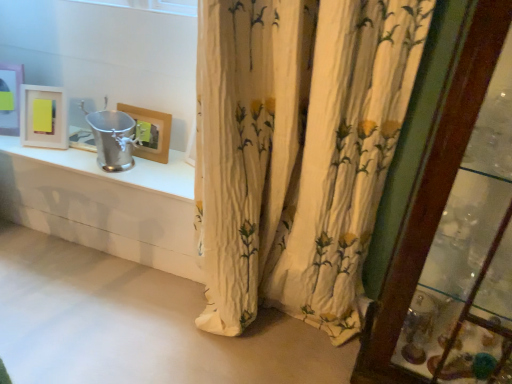
Question: Is the position of matte white picture frame at upper left, which ranks as the 1th picture frame in left-to-right order, less distant than that of matte white picture frame at upper left, which is counted as the 2th picture frame, starting from the right?

Choices:
 (A) no
 (B) yes

Answer: (A)

Question: From a real-world perspective, is matte white picture frame at upper left, which ranks as the 1th picture frame in left-to-right order, located higher than matte white picture frame at upper left, the second picture frame positioned from the left?

Choices:
 (A) yes
 (B) no

Answer: (A)

Question: Is matte white picture frame at upper left, which is counted as the third picture frame, starting from the right, wider than matte white picture frame at upper left, which is counted as the 2th picture frame, starting from the right?

Choices:
 (A) yes
 (B) no

Answer: (B)

Question: From the image's perspective, would you say matte white picture frame at upper left, which ranks as the 1th picture frame in left-to-right order, is shown under matte white picture frame at upper left, which is counted as the 2th picture frame, starting from the right?

Choices:
 (A) no
 (B) yes

Answer: (A)

Question: From a real-world perspective, is matte white picture frame at upper left, which is counted as the third picture frame, starting from the right, beneath matte white picture frame at upper left, which is counted as the 2th picture frame, starting from the right?

Choices:
 (A) yes
 (B) no

Answer: (B)

Question: Does matte white picture frame at upper left, which ranks as the 1th picture frame in left-to-right order, have a lesser height compared to matte white picture frame at upper left, the second picture frame positioned from the left?

Choices:
 (A) no
 (B) yes

Answer: (A)

Question: Is matte wooden picture frame at upper center, marked as the third picture frame in a left-to-right arrangement, thinner than white floral fabric curtain at center?

Choices:
 (A) no
 (B) yes

Answer: (B)

Question: Is matte wooden picture frame at upper center, marked as the third picture frame in a left-to-right arrangement, facing towards white floral fabric curtain at center?

Choices:
 (A) yes
 (B) no

Answer: (B)

Question: Is matte wooden picture frame at upper center, marked as the third picture frame in a left-to-right arrangement, bigger than white floral fabric curtain at center?

Choices:
 (A) yes
 (B) no

Answer: (B)

Question: From the image's perspective, is matte wooden picture frame at upper center, marked as the third picture frame in a left-to-right arrangement, below white floral fabric curtain at center?

Choices:
 (A) yes
 (B) no

Answer: (B)

Question: Is matte wooden picture frame at upper center, marked as the third picture frame in a left-to-right arrangement, surrounding white floral fabric curtain at center?

Choices:
 (A) no
 (B) yes

Answer: (A)

Question: Is matte wooden picture frame at upper center, marked as the third picture frame in a left-to-right arrangement, at the right side of white floral fabric curtain at center?

Choices:
 (A) no
 (B) yes

Answer: (A)

Question: Is matte white picture frame at upper left, the second picture frame positioned from the left, looking in the opposite direction of matte white picture frame at upper left, which is counted as the third picture frame, starting from the right?

Choices:
 (A) no
 (B) yes

Answer: (A)